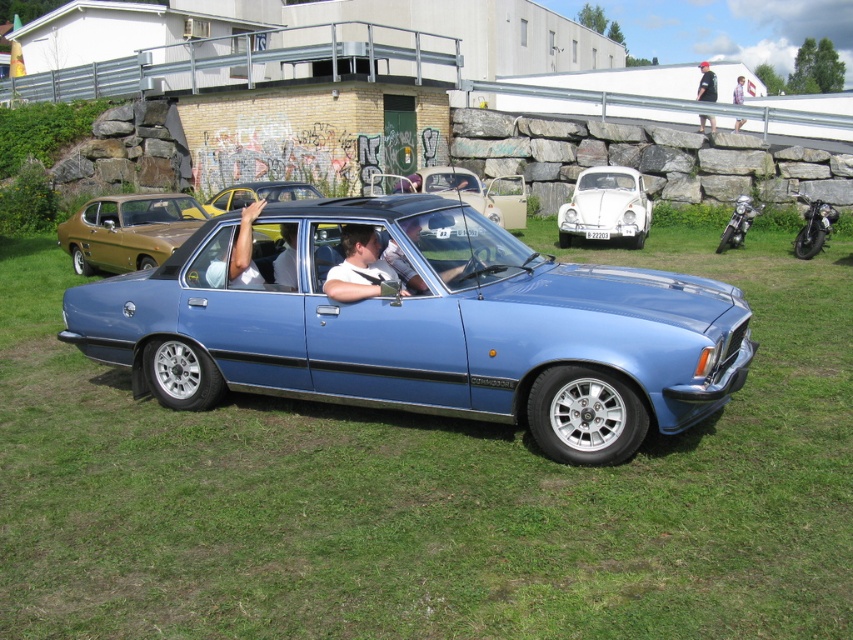
How distant is gold metallic coupe at left from light blue shirt at upper center?

gold metallic coupe at left is 14.55 meters away from light blue shirt at upper center.

Between gold metallic coupe at left and light blue shirt at upper center, which one appears on the right side from the viewer's perspective?

light blue shirt at upper center is more to the right.

The height and width of the screenshot is (640, 853). I want to click on gold metallic coupe at left, so click(x=128, y=230).

Where is `gold metallic coupe at left`? gold metallic coupe at left is located at coordinates (128, 230).

Consider the image. Does gold metallic coupe at left have a lesser height compared to white glossy car at center?

Correct, gold metallic coupe at left is not as tall as white glossy car at center.

Between gold metallic coupe at left and white glossy car at center, which one appears on the right side from the viewer's perspective?

From the viewer's perspective, white glossy car at center appears more on the right side.

Who is more distant from viewer, (163, 205) or (607, 186)?

The point (607, 186) is behind.

You are a GUI agent. You are given a task and a screenshot of the screen. Output one action in this format:
    pyautogui.click(x=<x>, y=<y>)
    Task: Click on the gold metallic coupe at left
    
    Given the screenshot: What is the action you would take?
    pyautogui.click(x=128, y=230)

Who is more forward, (308,422) or (418,172)?

Positioned in front is point (308,422).

Does green grass at center have a larger size compared to beige matte convertible at center?

Correct, green grass at center is larger in size than beige matte convertible at center.

Does point (347, 480) lie in front of point (497, 211)?

Yes, point (347, 480) is in front of point (497, 211).

The image size is (853, 640). What are the coordinates of `green grass at center` in the screenshot? It's located at (428, 490).